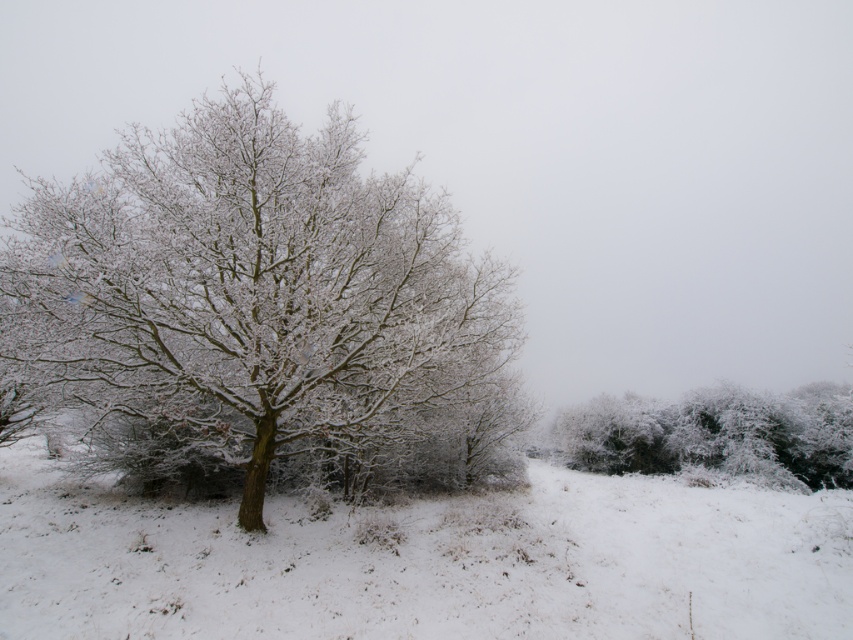
Is frosted bark tree at center thinner than white frosty bush at right?

In fact, frosted bark tree at center might be wider than white frosty bush at right.

Between point (367, 230) and point (740, 403), which one is positioned behind?

Positioned behind is point (740, 403).

At what (x,y) coordinates should I click in order to perform the action: click on frosted bark tree at center. Please return your answer as a coordinate pair (x, y). Image resolution: width=853 pixels, height=640 pixels. Looking at the image, I should click on (250, 289).

Between frosted bark tree at center and white fluffy snow at center, which one appears on the left side from the viewer's perspective?

From the viewer's perspective, frosted bark tree at center appears more on the left side.

Between frosted bark tree at center and white fluffy snow at center, which one has more height?

frosted bark tree at center

Does point (227, 116) come behind point (22, 449)?

No.

Find the location of a particular element. The height and width of the screenshot is (640, 853). frosted bark tree at center is located at coordinates (250, 289).

Who is higher up, white fluffy snow at center or white frosty bush at right?

Positioned higher is white fluffy snow at center.

At what (x,y) coordinates should I click in order to perform the action: click on white fluffy snow at center. Please return your answer as a coordinate pair (x, y). The height and width of the screenshot is (640, 853). Looking at the image, I should click on (424, 561).